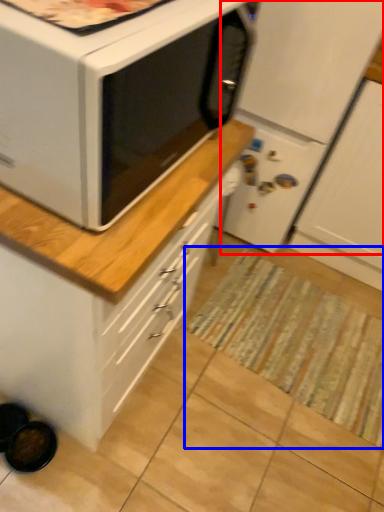
Question: Which object appears closest to the camera in this image, refrigerator (highlighted by a red box) or mat (highlighted by a blue box)?

Choices:
 (A) refrigerator
 (B) mat

Answer: (A)